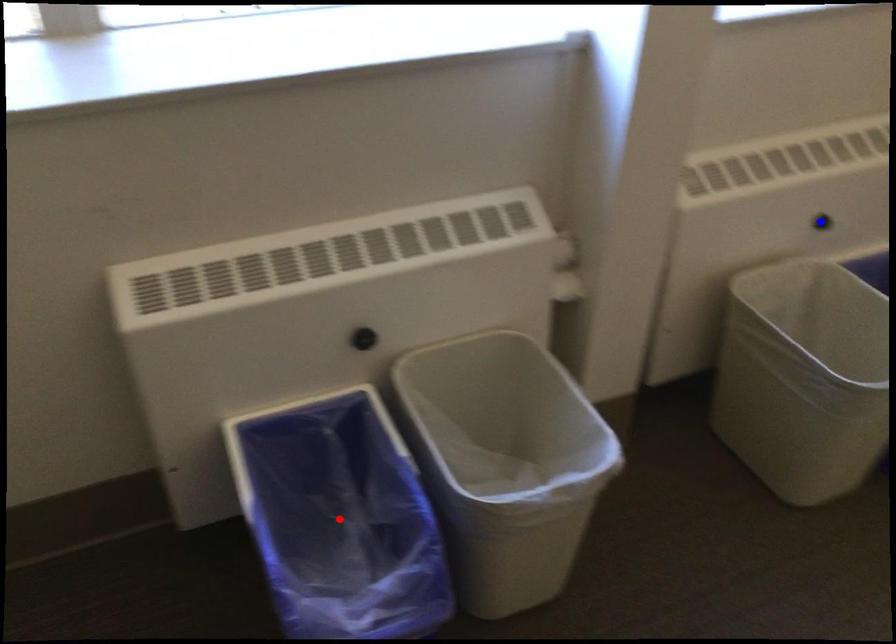
Question: Two points are marked on the image. Which point is closer to the camera?

Choices:
 (A) Blue point is closer.
 (B) Red point is closer.

Answer: (B)